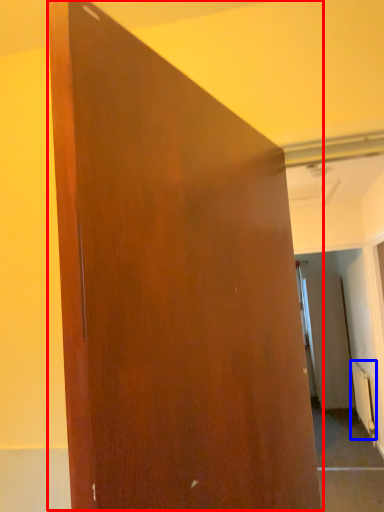
Question: Which point is further to the camera, door (highlighted by a red box) or radiator (highlighted by a blue box)?

Choices:
 (A) door
 (B) radiator

Answer: (B)